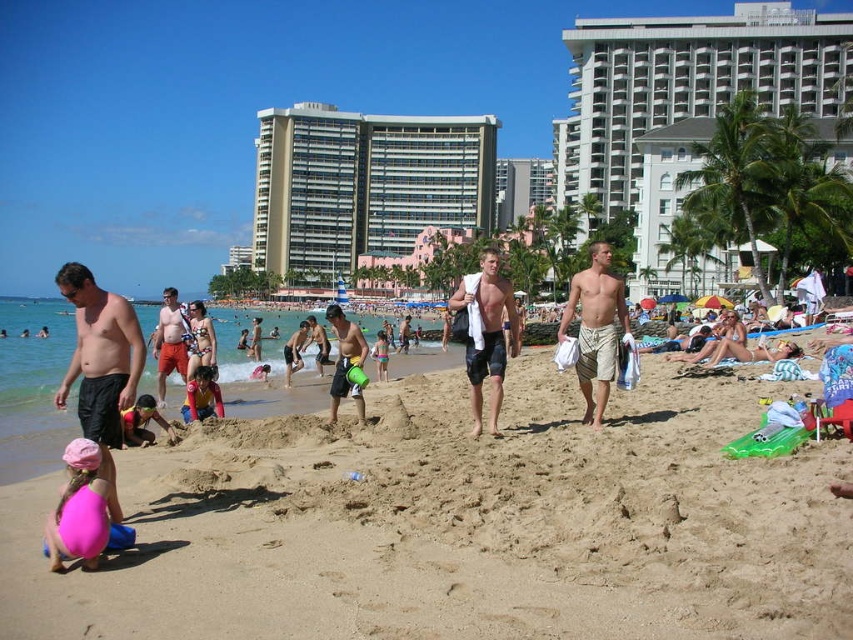
You are a photographer standing on the beach and want to take a photo of the tan shorts at center without the beige glass building at center blocking the view. What should you do?

Move to a position where the beige glass building at center is no longer between you and the tan shorts at center. Since the tan shorts at center is behind the beige glass building at center, moving to a side or behind the building would allow you to capture the tan shorts at center without obstruction.

You are standing at the point marked by the coordinates point (461, 524). Which object in the scene is directly in front of you?

The beige sandy beach at center is directly in front of you at point (461, 524).